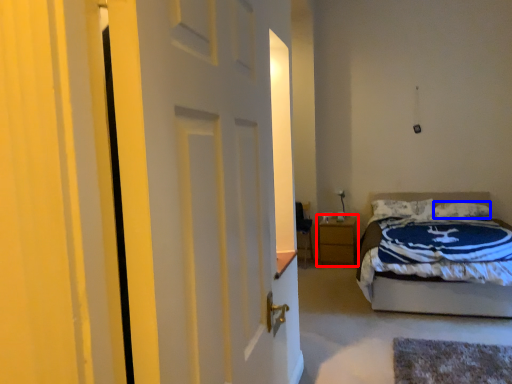
Question: Which point is further to the camera, nightstand (highlighted by a red box) or pillow (highlighted by a blue box)?

Choices:
 (A) nightstand
 (B) pillow

Answer: (A)